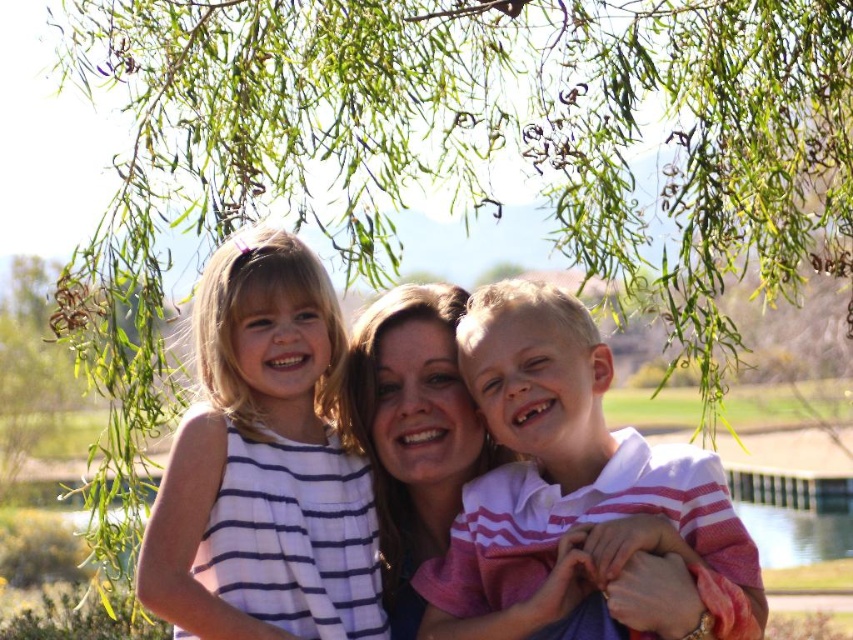
Is white striped dress at center in front of white striped shirt at center?

No, white striped dress at center is behind white striped shirt at center.

Which is in front, point (297, 416) or point (637, 634)?

Point (637, 634) is more forward.

Does point (384, 614) lie in front of point (735, 620)?

No, it is not.

The width and height of the screenshot is (853, 640). Identify the location of white striped dress at center. (263, 465).